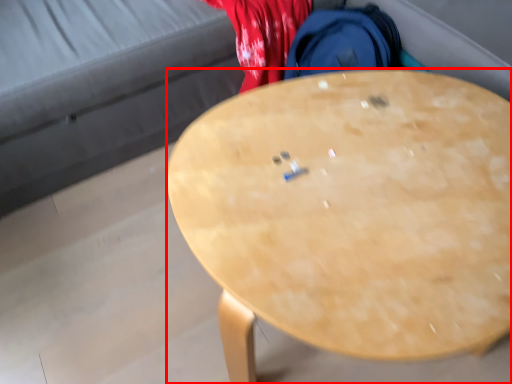
Question: From the image's perspective, where is desk (annotated by the red box) located in relation to studio couch in the image?

Choices:
 (A) above
 (B) below

Answer: (B)